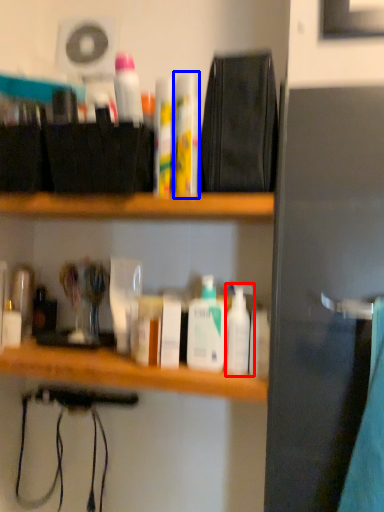
Question: Among these objects, which one is farthest to the camera, toiletry (highlighted by a red box) or toiletry (highlighted by a blue box)?

Choices:
 (A) toiletry
 (B) toiletry

Answer: (A)